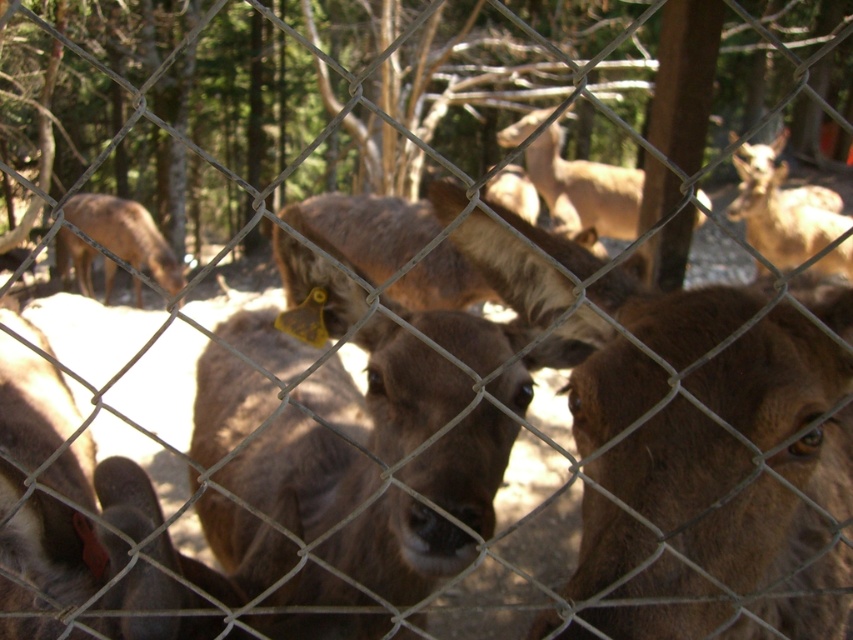
You are a zookeeper trying to locate two specific points in the enclosure for maintenance. The points are labeled as point 1 at coordinates point (780, 596) and point 2 at coordinates point (282, 481). From your vantage point, which point is closer to you?

Point (780, 596) is in front of point (282, 481), so point 1 at coordinates point (780, 596) is closer to you.

You are a researcher observing deer in a fenced enclosure. You notice a deer with a yellow ear tag and another deer represented by the point at coordinates (x=781, y=218). Which deer is closer to the camera?

The brown fur deer at center represented by point (x=781, y=218) is closer to the camera than the deer with the yellow ear tag because the deer with the yellow ear tag is in the foreground, while the deer at the point is at the center. Wait, this seems conflicting. Let me check again. The scene says the foreground has two deer, one with a yellow tag. The point is at center, which might be in the background. Hmm, maybe the coordinates indicate position but not depth. The objects description says the point is